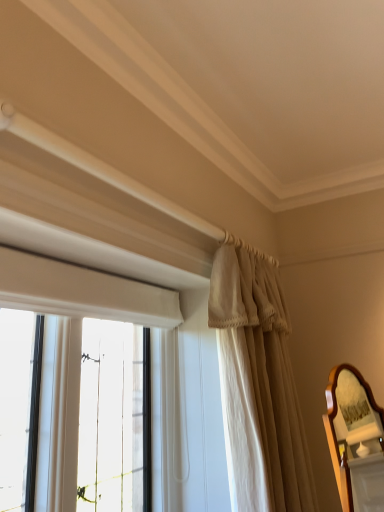
Question: Considering the relative positions of beige fabric curtain at upper right and wooden mirror at right in the image provided, is beige fabric curtain at upper right to the left or to the right of wooden mirror at right?

Choices:
 (A) right
 (B) left

Answer: (B)

Question: From a real-world perspective, is beige fabric curtain at upper right positioned above or below wooden mirror at right?

Choices:
 (A) above
 (B) below

Answer: (A)

Question: Is beige fabric curtain at upper right in front of or behind wooden mirror at right in the image?

Choices:
 (A) behind
 (B) front

Answer: (A)

Question: Based on their positions, is wooden mirror at right located to the left or right of beige fabric curtain at upper right?

Choices:
 (A) left
 (B) right

Answer: (B)

Question: Looking at their shapes, would you say wooden mirror at right is wider or thinner than beige fabric curtain at upper right?

Choices:
 (A) thin
 (B) wide

Answer: (A)

Question: In terms of height, does wooden mirror at right look taller or shorter compared to beige fabric curtain at upper right?

Choices:
 (A) tall
 (B) short

Answer: (B)

Question: Considering the positions of wooden mirror at right and beige fabric curtain at upper right in the image, is wooden mirror at right bigger or smaller than beige fabric curtain at upper right?

Choices:
 (A) big
 (B) small

Answer: (B)